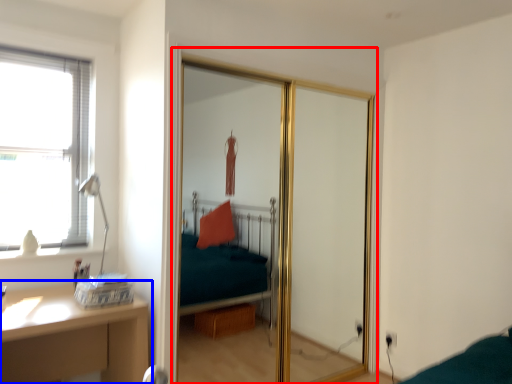
Question: Among these objects, which one is nearest to the camera, screen door (highlighted by a red box) or table (highlighted by a blue box)?

Choices:
 (A) screen door
 (B) table

Answer: (B)